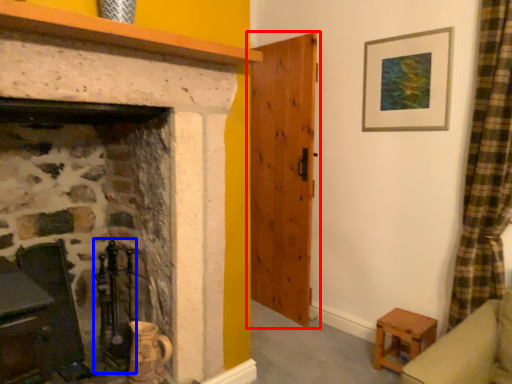
Question: Among these objects, which one is nearest to the camera, door (highlighted by a red box) or chair (highlighted by a blue box)?

Choices:
 (A) door
 (B) chair

Answer: (B)